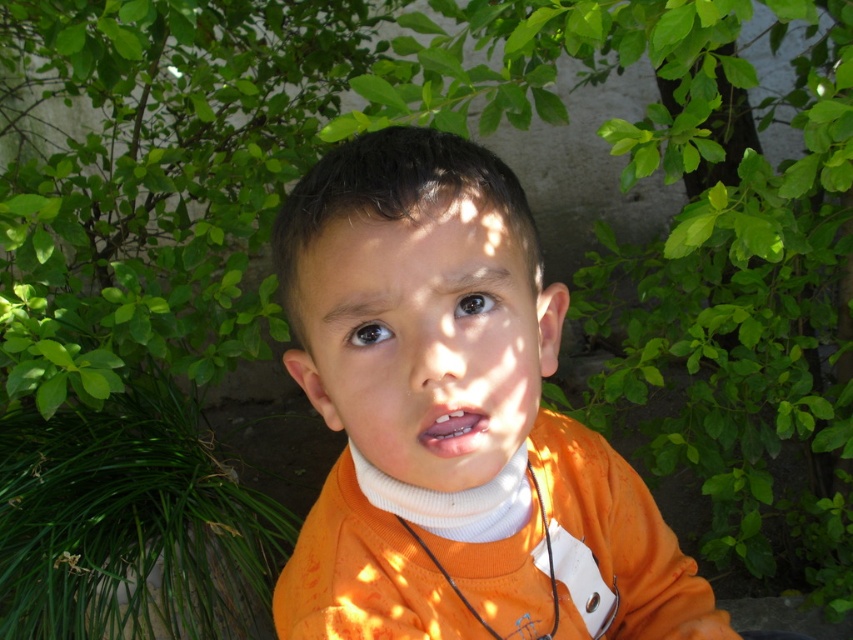
Question: Considering the relative positions of orange fabric shirt at center and orange matte shirt at center in the image provided, where is orange fabric shirt at center located with respect to orange matte shirt at center?

Choices:
 (A) right
 (B) left

Answer: (A)

Question: Which point is closer to the camera?

Choices:
 (A) orange fabric shirt at center
 (B) matte orange mouth at center
 (C) orange matte shirt at center

Answer: (C)

Question: Estimate the real-world distances between objects in this image. Which object is farther from the orange matte shirt at center?

Choices:
 (A) matte orange mouth at center
 (B) orange fabric shirt at center

Answer: (B)

Question: Is orange fabric shirt at center wider than matte orange mouth at center?

Choices:
 (A) yes
 (B) no

Answer: (A)

Question: Considering the relative positions of orange matte shirt at center and matte orange mouth at center in the image provided, where is orange matte shirt at center located with respect to matte orange mouth at center?

Choices:
 (A) above
 (B) below

Answer: (A)

Question: Which of the following is the farthest from the observer?

Choices:
 (A) orange matte shirt at center
 (B) matte orange mouth at center

Answer: (B)